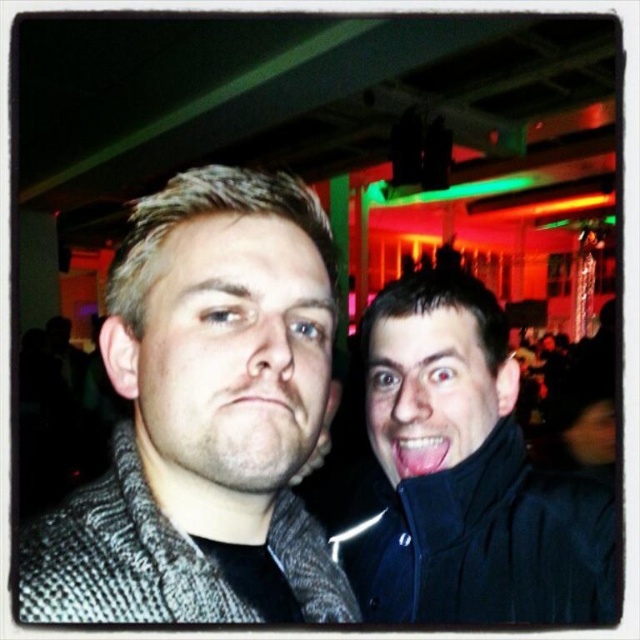
Can you confirm if pink glossy tongue at right is shorter than pink matte lips at center?

Yes.

Based on the photo, can you confirm if pink glossy tongue at right is positioned to the left of pink matte lips at center?

Incorrect, pink glossy tongue at right is not on the left side of pink matte lips at center.

At what (x,y) coordinates should I click in order to perform the action: click on pink glossy tongue at right. Please return your answer as a coordinate pair (x, y). This screenshot has height=640, width=640. Looking at the image, I should click on (419, 454).

Between black matte jacket at right and pink matte lips at center, which one has more height?

Standing taller between the two is black matte jacket at right.

Does black matte jacket at right have a lesser height compared to pink matte lips at center?

No.

Between point (582, 500) and point (237, 410), which one is positioned behind?

Point (582, 500)

Locate an element on the screen. Image resolution: width=640 pixels, height=640 pixels. black matte jacket at right is located at coordinates (464, 476).

Is gray textured coat at left further to the viewer compared to smooth skin face at right?

No, it is in front of smooth skin face at right.

Is gray textured coat at left wider than smooth skin face at right?

Correct, the width of gray textured coat at left exceeds that of smooth skin face at right.

Between point (177, 257) and point (460, 416), which one is positioned behind?

The point (460, 416) is more distant.

Locate an element on the screen. gray textured coat at left is located at coordinates (204, 419).